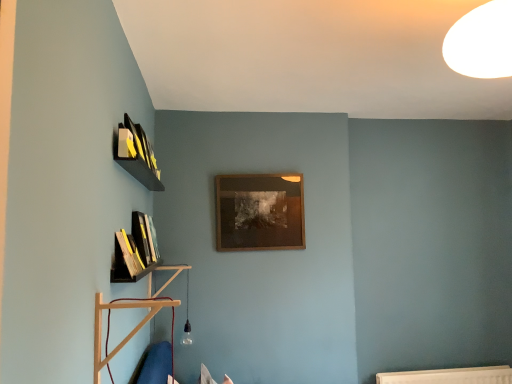
The image size is (512, 384). What do you see at coordinates (145, 237) in the screenshot?
I see `hardcover book at left, marked as the first book in a back-to-front arrangement` at bounding box center [145, 237].

The image size is (512, 384). What do you see at coordinates (139, 323) in the screenshot?
I see `wooden shelf at lower left, which ranks as the first shelf in front-to-back order` at bounding box center [139, 323].

Find the location of a particular element. The width and height of the screenshot is (512, 384). wooden picture frame at center is located at coordinates (259, 212).

Find the location of a particular element. Image resolution: width=512 pixels, height=384 pixels. wooden book at lower left, which is the 2th book from back to front is located at coordinates (125, 259).

The width and height of the screenshot is (512, 384). What do you see at coordinates (125, 259) in the screenshot?
I see `wooden book at lower left, which is counted as the 1th book, starting from the front` at bounding box center [125, 259].

Locate an element on the screen. The height and width of the screenshot is (384, 512). black matte shelf at left, placed as the 2th shelf when sorted from front to back is located at coordinates (136, 250).

From a real-world perspective, is wooden picture frame at center on black matte shelf at left, the 1th shelf in the back-to-front sequence?

Correct, in the physical world, wooden picture frame at center is higher than black matte shelf at left, the 1th shelf in the back-to-front sequence.

Is wooden picture frame at center in front of or behind black matte shelf at left, the 1th shelf in the back-to-front sequence, in the image?

In the image, wooden picture frame at center appears behind black matte shelf at left, the 1th shelf in the back-to-front sequence.

Is wooden picture frame at center far away from black matte shelf at left, placed as the 2th shelf when sorted from front to back?

No, wooden picture frame at center is not far from black matte shelf at left, placed as the 2th shelf when sorted from front to back.

Is point (279, 210) farther from camera compared to point (124, 242)?

That is True.

Is hardcover book at left, arranged as the 2th book when viewed from the front, surrounded by wooden shelf at lower left, which ranks as the first shelf in front-to-back order?

No, hardcover book at left, arranged as the 2th book when viewed from the front, is located outside of wooden shelf at lower left, which ranks as the first shelf in front-to-back order.

Looking at the image, does wooden shelf at lower left, which is counted as the second shelf, starting from the back, seem bigger or smaller compared to hardcover book at left, marked as the first book in a back-to-front arrangement?

Considering their sizes, wooden shelf at lower left, which is counted as the second shelf, starting from the back, takes up more space than hardcover book at left, marked as the first book in a back-to-front arrangement.

Is wooden shelf at lower left, which ranks as the first shelf in front-to-back order, positioned far away from hardcover book at left, arranged as the 2th book when viewed from the front?

wooden shelf at lower left, which ranks as the first shelf in front-to-back order, is near hardcover book at left, arranged as the 2th book when viewed from the front, not far away.

From a real-world perspective, which object stands above the other?

wooden picture frame at center is physically above.

Identify the location of the 2nd book in front of the wooden picture frame at center, starting your count from the anchor. (125, 259).

Which object is more forward, wooden book at lower left, which is the 2th book from back to front, or wooden picture frame at center?

wooden book at lower left, which is the 2th book from back to front.

Based on their positions, is wooden book at lower left, which is counted as the 1th book, starting from the front, located to the left or right of wooden picture frame at center?

Clearly, wooden book at lower left, which is counted as the 1th book, starting from the front, is on the left of wooden picture frame at center in the image.

Is wooden shelf at lower left, which ranks as the first shelf in front-to-back order, surrounding wooden picture frame at center?

No, wooden shelf at lower left, which ranks as the first shelf in front-to-back order, does not contain wooden picture frame at center.

Is wooden shelf at lower left, which is counted as the second shelf, starting from the back, far away from wooden picture frame at center?

Actually, wooden shelf at lower left, which is counted as the second shelf, starting from the back, and wooden picture frame at center are a little close together.

Which of these two, wooden shelf at lower left, which ranks as the first shelf in front-to-back order, or wooden picture frame at center, is smaller?

wooden shelf at lower left, which ranks as the first shelf in front-to-back order.

From the image's perspective, does wooden shelf at lower left, which is counted as the second shelf, starting from the back, appear lower than wooden picture frame at center?

Yes, from the image's perspective, wooden shelf at lower left, which is counted as the second shelf, starting from the back, is below wooden picture frame at center.

Who is taller, wooden picture frame at center or hardcover book at left, arranged as the 2th book when viewed from the front?

Standing taller between the two is wooden picture frame at center.

Can you confirm if wooden picture frame at center is smaller than hardcover book at left, marked as the first book in a back-to-front arrangement?

Actually, wooden picture frame at center might be larger than hardcover book at left, marked as the first book in a back-to-front arrangement.

Are wooden picture frame at center and hardcover book at left, marked as the first book in a back-to-front arrangement, beside each other?

No, wooden picture frame at center is not making contact with hardcover book at left, marked as the first book in a back-to-front arrangement.

From the wooden picture frame at center, count the 2nd book to the left and point to it. Please provide its 2D coordinates.

[(145, 237)]

Can you confirm if wooden book at lower left, which is the 2th book from back to front, is smaller than hardcover book at left, arranged as the 2th book when viewed from the front?

Yes.

From the picture: How many degrees apart are the facing directions of wooden book at lower left, which is the 2th book from back to front, and hardcover book at left, arranged as the 2th book when viewed from the front?

There is a 0.4-degree angle between the facing directions of wooden book at lower left, which is the 2th book from back to front, and hardcover book at left, arranged as the 2th book when viewed from the front.

Considering the points (125, 243) and (142, 230), which point is behind, point (125, 243) or point (142, 230)?

The point (142, 230) is farther from the camera.

From a real-world perspective, relative to hardcover book at left, arranged as the 2th book when viewed from the front, is wooden book at lower left, which is counted as the 1th book, starting from the front, vertically above or below?

Clearly, from a real-world perspective, wooden book at lower left, which is counted as the 1th book, starting from the front, is below hardcover book at left, arranged as the 2th book when viewed from the front.

How far apart are wooden shelf at lower left, which is counted as the second shelf, starting from the back, and black matte shelf at left, placed as the 2th shelf when sorted from front to back?

wooden shelf at lower left, which is counted as the second shelf, starting from the back, and black matte shelf at left, placed as the 2th shelf when sorted from front to back, are 25.67 centimeters apart from each other.

Can you confirm if wooden shelf at lower left, which is counted as the second shelf, starting from the back, is positioned to the right of black matte shelf at left, placed as the 2th shelf when sorted from front to back?

Indeed, wooden shelf at lower left, which is counted as the second shelf, starting from the back, is positioned on the right side of black matte shelf at left, placed as the 2th shelf when sorted from front to back.

Is wooden shelf at lower left, which ranks as the first shelf in front-to-back order, taller than black matte shelf at left, placed as the 2th shelf when sorted from front to back?

Incorrect, the height of wooden shelf at lower left, which ranks as the first shelf in front-to-back order, is not larger of that of black matte shelf at left, placed as the 2th shelf when sorted from front to back.

Is wooden shelf at lower left, which is counted as the second shelf, starting from the back, further to camera compared to black matte shelf at left, the 1th shelf in the back-to-front sequence?

No, wooden shelf at lower left, which is counted as the second shelf, starting from the back, is in front of black matte shelf at left, the 1th shelf in the back-to-front sequence.

Identify the location of the 2nd shelf to the left when counting from the wooden picture frame at center. This screenshot has width=512, height=384. (136, 250).

Which shelf is the 2nd one when counting from the right side of the hardcover book at left, marked as the first book in a back-to-front arrangement? Please provide its 2D coordinates.

[(139, 323)]

Considering their positions, is wooden picture frame at center positioned closer to wooden shelf at lower left, which is counted as the second shelf, starting from the back, than black matte shelf at left, placed as the 2th shelf when sorted from front to back?

black matte shelf at left, placed as the 2th shelf when sorted from front to back, is closer to wooden shelf at lower left, which is counted as the second shelf, starting from the back.

Which object lies nearer to the anchor point black matte shelf at left, placed as the 2th shelf when sorted from front to back, wooden shelf at lower left, which ranks as the first shelf in front-to-back order, or wooden picture frame at center?

wooden shelf at lower left, which ranks as the first shelf in front-to-back order, is positioned closer to the anchor black matte shelf at left, placed as the 2th shelf when sorted from front to back.

When comparing their distances from wooden shelf at lower left, which is counted as the second shelf, starting from the back, does black matte shelf at left, the 1th shelf in the back-to-front sequence, or wooden picture frame at center seem further?

wooden picture frame at center is further to wooden shelf at lower left, which is counted as the second shelf, starting from the back.

Which object lies nearer to the anchor point black matte shelf at left, the 1th shelf in the back-to-front sequence, hardcover book at left, arranged as the 2th book when viewed from the front, or wooden picture frame at center?

Among the two, hardcover book at left, arranged as the 2th book when viewed from the front, is located nearer to black matte shelf at left, the 1th shelf in the back-to-front sequence.

Looking at the image, which one is located closer to wooden picture frame at center, hardcover book at left, arranged as the 2th book when viewed from the front, or wooden shelf at lower left, which ranks as the first shelf in front-to-back order?

wooden shelf at lower left, which ranks as the first shelf in front-to-back order.

Consider the image. From the image, which object appears to be nearer to hardcover book at left, arranged as the 2th book when viewed from the front, wooden picture frame at center or black matte shelf at left, placed as the 2th shelf when sorted from front to back?

black matte shelf at left, placed as the 2th shelf when sorted from front to back, is positioned closer to the anchor hardcover book at left, arranged as the 2th book when viewed from the front.

From the picture: Considering their positions, is wooden book at lower left, which is the 2th book from back to front, positioned further to hardcover book at left, arranged as the 2th book when viewed from the front, than wooden picture frame at center?

wooden picture frame at center is further to hardcover book at left, arranged as the 2th book when viewed from the front.

Looking at this image, based on their spatial positions, is wooden book at lower left, which is the 2th book from back to front, or hardcover book at left, marked as the first book in a back-to-front arrangement, further from black matte shelf at left, placed as the 2th shelf when sorted from front to back?

The object further to black matte shelf at left, placed as the 2th shelf when sorted from front to back, is wooden book at lower left, which is the 2th book from back to front.

This screenshot has height=384, width=512. In order to click on book between wooden shelf at lower left, which is counted as the second shelf, starting from the back, and hardcover book at left, arranged as the 2th book when viewed from the front, in the front-back direction in this screenshot , I will do `click(125, 259)`.

The height and width of the screenshot is (384, 512). Identify the location of shelf located between wooden shelf at lower left, which ranks as the first shelf in front-to-back order, and wooden picture frame at center in the depth direction. (136, 250).

Locate an element on the screen. book between black matte shelf at left, placed as the 2th shelf when sorted from front to back, and hardcover book at left, arranged as the 2th book when viewed from the front, from front to back is located at coordinates (125, 259).

This screenshot has width=512, height=384. Identify the location of shelf located between wooden shelf at lower left, which is counted as the second shelf, starting from the back, and hardcover book at left, arranged as the 2th book when viewed from the front, in the depth direction. (136, 250).